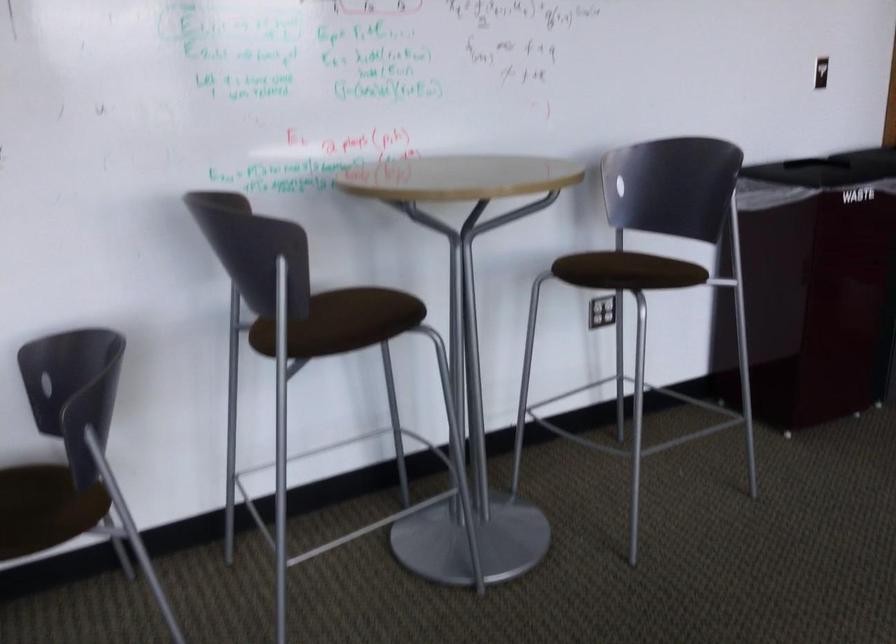
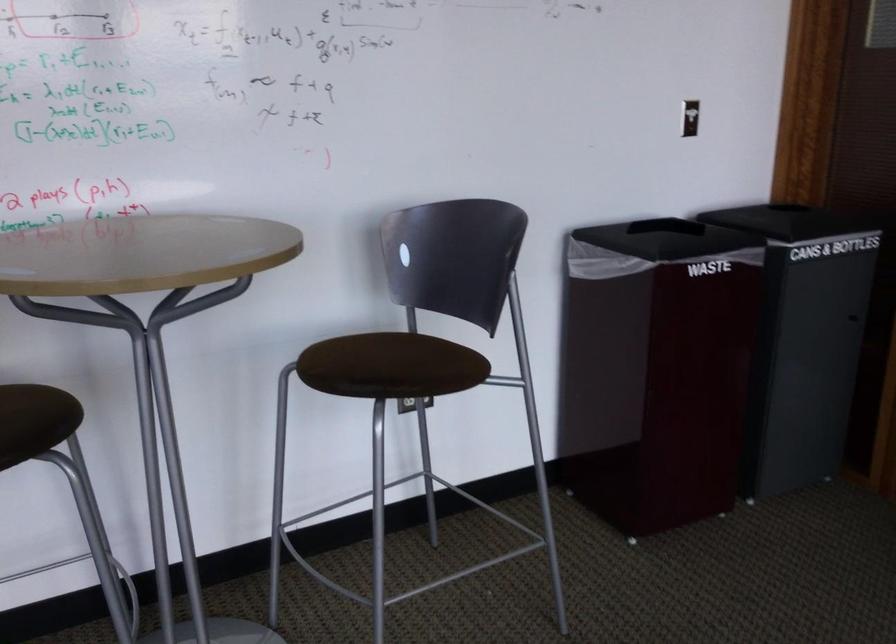
Question: The camera is either moving clockwise (left) or counter-clockwise (right) around the object. The first image is from the beginning of the video and the second image is from the end. Is the camera moving left or right when shooting the video?

Choices:
 (A) Left
 (B) Right

Answer: (A)